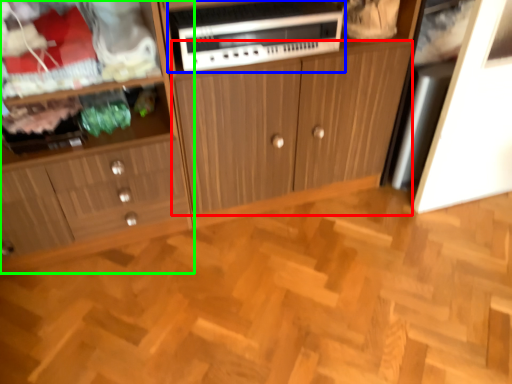
Question: Which is farther away from cabinetry (highlighted by a red box)? home appliance (highlighted by a blue box) or cabinetry (highlighted by a green box)?

Choices:
 (A) home appliance
 (B) cabinetry

Answer: (B)